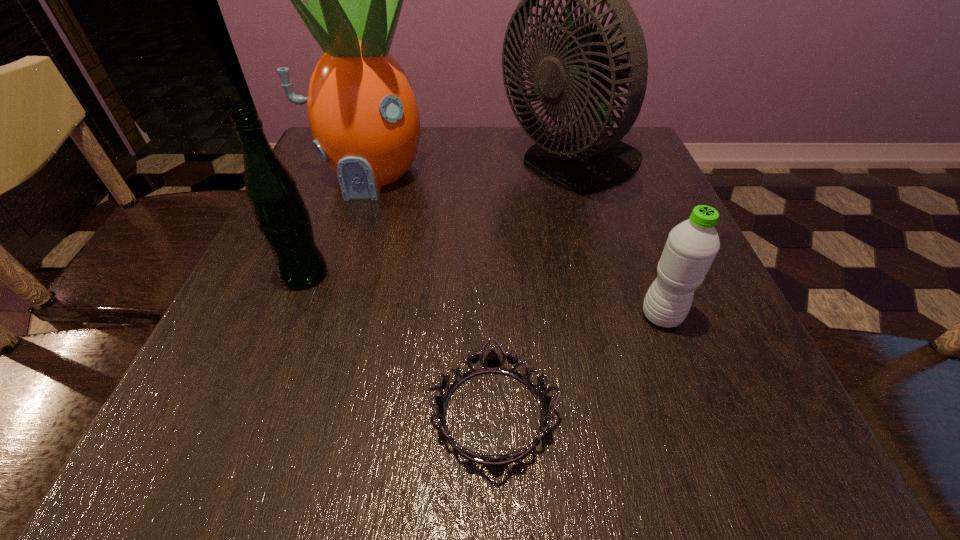
Locate an element on the screen. This screenshot has height=540, width=960. pineapple that is positioned at the left edge is located at coordinates point(362,110).

I want to click on beer bottle at the left edge, so click(x=281, y=216).

I want to click on fan located at the right edge, so click(585, 71).

Identify the location of water bottle that is positioned at the right edge. (692, 245).

Where is `object that is at the far left corner`? object that is at the far left corner is located at coordinates (362, 110).

The image size is (960, 540). What are the coordinates of `object that is at the far right corner` in the screenshot? It's located at (585, 71).

In the image, there is a desktop. In order to click on vacant space at the far edge in this screenshot , I will do `click(404, 175)`.

Image resolution: width=960 pixels, height=540 pixels. What are the coordinates of `vacant space at the near edge` in the screenshot? It's located at (618, 443).

Identify the location of vacant position at the left edge of the desktop. (305, 335).

The image size is (960, 540). What are the coordinates of `free space at the right edge of the desktop` in the screenshot? It's located at (691, 402).